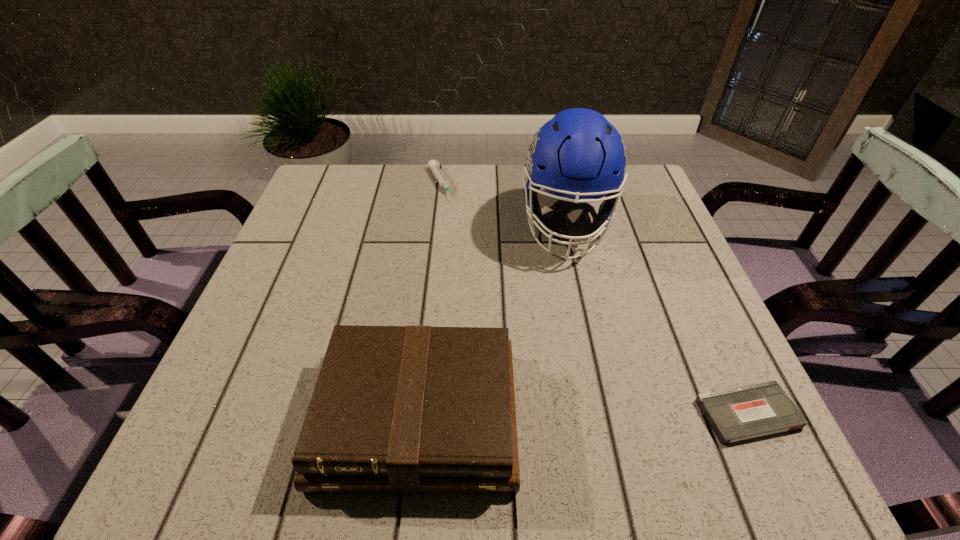
Locate an element on the screen. The width and height of the screenshot is (960, 540). Bible is located at coordinates (404, 409).

The height and width of the screenshot is (540, 960). I want to click on videotape, so click(738, 414).

This screenshot has width=960, height=540. I want to click on the shortest object, so click(x=738, y=414).

This screenshot has width=960, height=540. Identify the location of football helmet. (578, 154).

Find the location of a particular element. This screenshot has width=960, height=540. the tallest object is located at coordinates (578, 154).

The width and height of the screenshot is (960, 540). What are the coordinates of `syringe` in the screenshot? It's located at (433, 165).

You are a GUI agent. You are given a task and a screenshot of the screen. Output one action in this format:
    pyautogui.click(x=<x>, y=<y>)
    Task: Click on the vacant space located 0.110m on the back of the rightmost object
    
    Given the screenshot: What is the action you would take?
    pyautogui.click(x=711, y=335)

Find the location of a particular element. This screenshot has height=540, width=960. free space located 0.090m on the face guard of the tallest object is located at coordinates (569, 298).

The image size is (960, 540). Identify the location of vacant point located on the face guard of the tallest object. (569, 284).

Locate an element on the screen. Image resolution: width=960 pixels, height=540 pixels. free space located on the face guard of the tallest object is located at coordinates (570, 413).